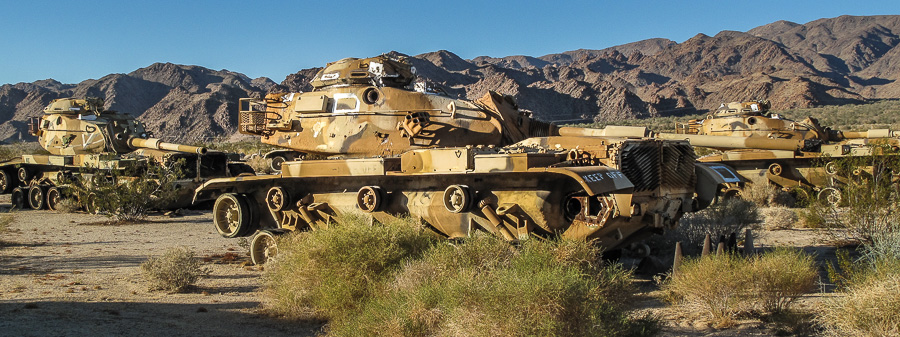
This screenshot has width=900, height=337. Identify the location of green plants on ground. (742, 293), (505, 288), (336, 248), (184, 271), (844, 285), (855, 243).